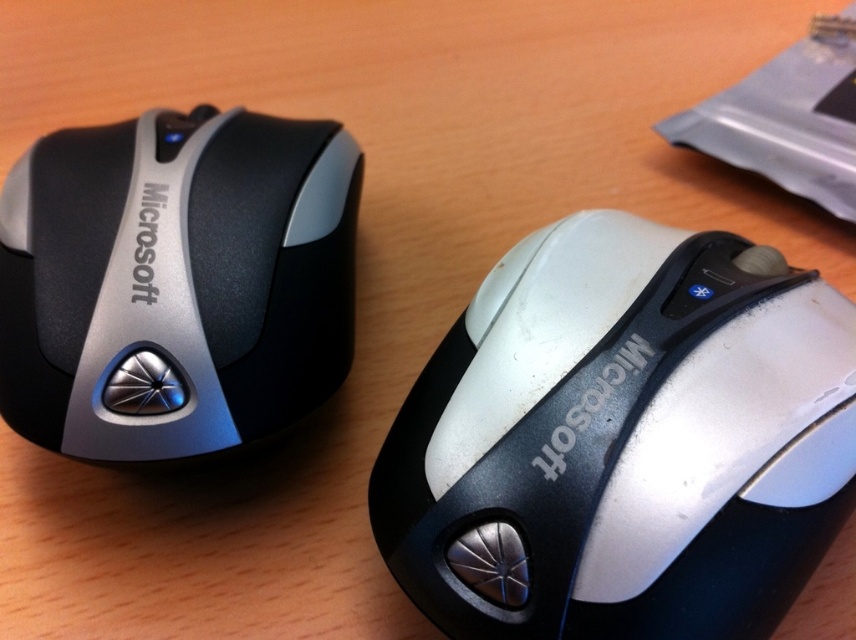
Does point (734, 326) come farther from viewer compared to point (16, 262)?

No, it is in front of (16, 262).

Who is positioned more to the left, white matte/black glossy mouse at center or matte black mouse at left?

matte black mouse at left is more to the left.

Where is `white matte/black glossy mouse at center`? white matte/black glossy mouse at center is located at coordinates (622, 442).